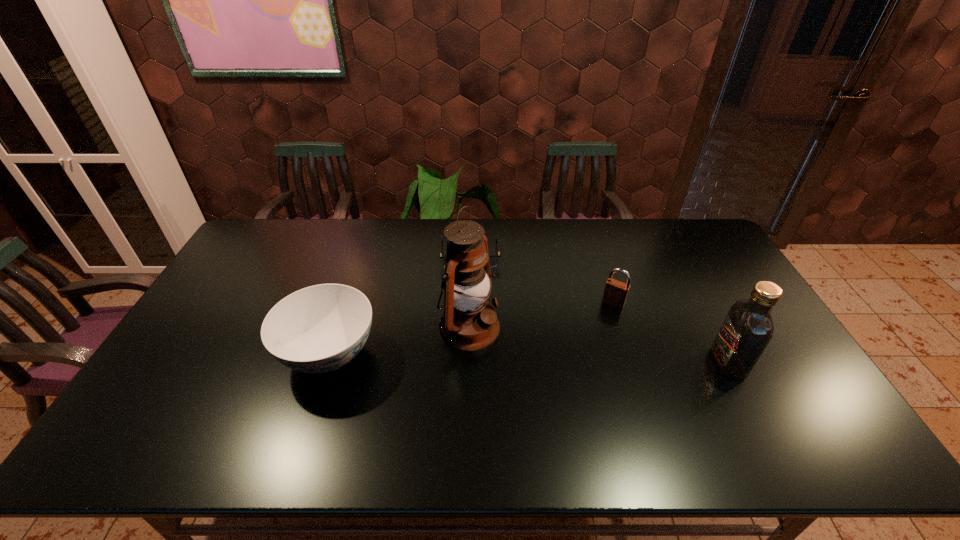
Where is `blank area in the image that satisfies the following two spatial constraints: 1. on the front side of the rightmost object; 2. on the front-facing side of the tallest object`? blank area in the image that satisfies the following two spatial constraints: 1. on the front side of the rightmost object; 2. on the front-facing side of the tallest object is located at coordinates (468, 362).

Where is `vacant space that satisfies the following two spatial constraints: 1. on the front side of the rightmost object; 2. on the front-facing side of the leftmost object`? vacant space that satisfies the following two spatial constraints: 1. on the front side of the rightmost object; 2. on the front-facing side of the leftmost object is located at coordinates (326, 362).